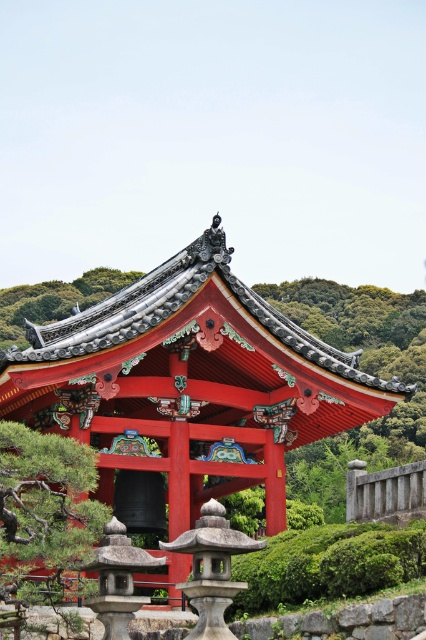
You are standing in front of the bell pavilion and notice two green trees. The green textured pine tree at center and the green leafy tree at upper left. Which tree is positioned higher up in the image?

The green leafy tree at upper left is positioned higher up in the image than the green textured pine tree at center.